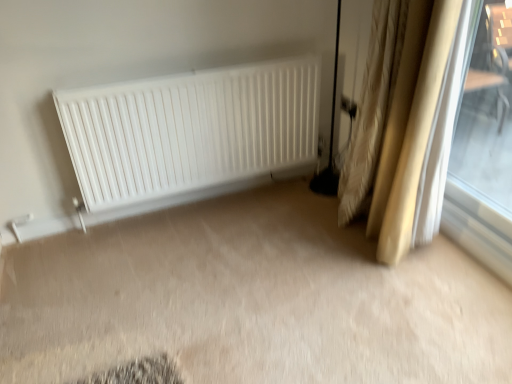
Question: In terms of width, does white matte radiator at center look wider or thinner when compared to beige textured curtains at right?

Choices:
 (A) thin
 (B) wide

Answer: (A)

Question: In the image, is white matte radiator at center on the left side or the right side of beige textured curtains at right?

Choices:
 (A) left
 (B) right

Answer: (A)

Question: Which of these objects is positioned farthest from the beige textured curtains at right?

Choices:
 (A) white matte radiator at center
 (B) transparent glass window at right

Answer: (B)

Question: Estimate the real-world distances between objects in this image. Which object is closer to the beige textured curtains at right?

Choices:
 (A) white matte radiator at center
 (B) transparent glass window at right

Answer: (A)